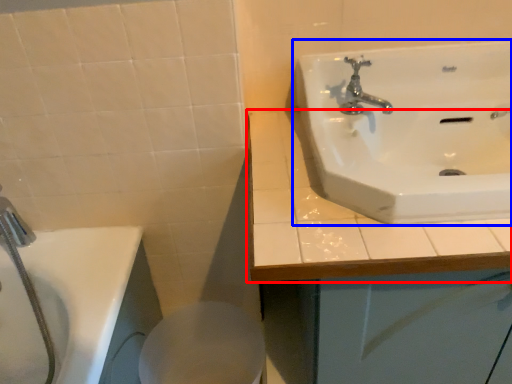
Question: Which of the following is the closest to the observer, counter top (highlighted by a red box) or sink (highlighted by a blue box)?

Choices:
 (A) counter top
 (B) sink

Answer: (B)